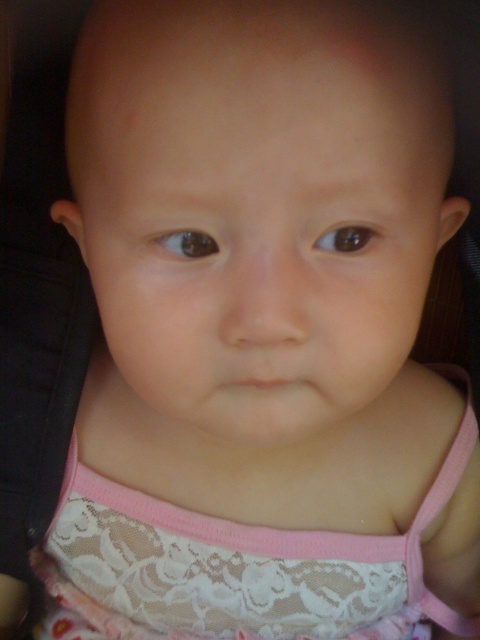
Question: Is lace fabric dress at center thinner than pink fabric strap at center?

Choices:
 (A) no
 (B) yes

Answer: (A)

Question: Does lace fabric dress at center appear over pink fabric strap at center?

Choices:
 (A) no
 (B) yes

Answer: (A)

Question: Which point is farther from the camera taking this photo?

Choices:
 (A) (382, 616)
 (B) (428, 518)

Answer: (A)

Question: Is lace fabric dress at center above pink fabric strap at center?

Choices:
 (A) no
 (B) yes

Answer: (A)

Question: Which object is closer to the camera taking this photo?

Choices:
 (A) pink fabric strap at center
 (B) lace fabric dress at center

Answer: (B)

Question: Among these points, which one is farthest from the camera?

Choices:
 (A) (86, 592)
 (B) (408, 534)

Answer: (A)